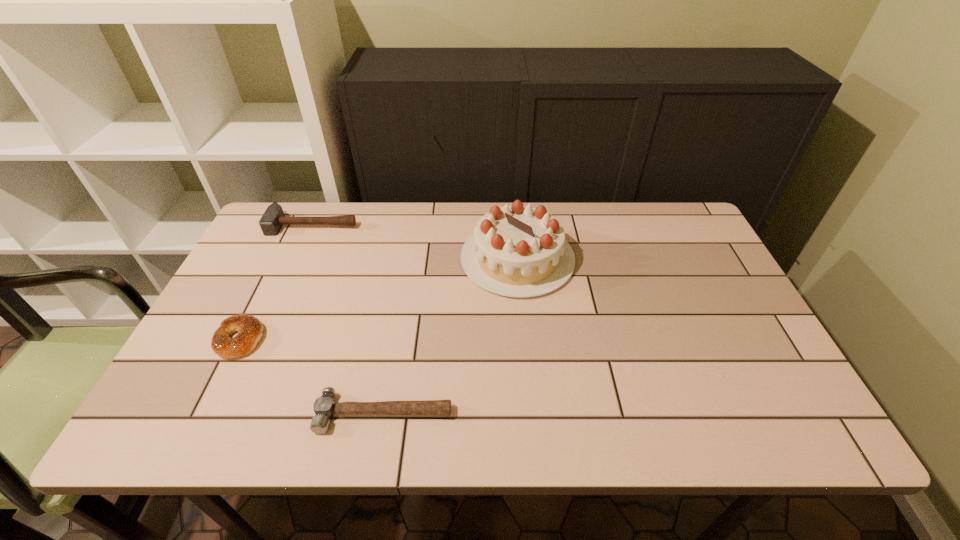
Locate an element on the screen. The width and height of the screenshot is (960, 540). birthday cake is located at coordinates (517, 251).

The image size is (960, 540). I want to click on the rightmost object, so click(517, 251).

This screenshot has height=540, width=960. Find the location of `the taller hammer`. the taller hammer is located at coordinates (273, 219).

Locate an element on the screen. This screenshot has height=540, width=960. the left hammer is located at coordinates (273, 219).

Find the location of a particular element. The height and width of the screenshot is (540, 960). bagel is located at coordinates (249, 328).

At what (x,y) coordinates should I click in order to perform the action: click on the nearest object. Please return your answer as a coordinate pair (x, y). The image size is (960, 540). Looking at the image, I should click on (324, 407).

The image size is (960, 540). I want to click on the shorter hammer, so click(324, 407).

Where is `free space located 0.120m on the left of the birthday cake`? This screenshot has height=540, width=960. free space located 0.120m on the left of the birthday cake is located at coordinates (420, 259).

Locate an element on the screen. vacant space located 0.210m on the striking surface of the taller hammer is located at coordinates (286, 285).

Identify the location of free space located 0.080m on the front of the bagel. This screenshot has height=540, width=960. (214, 392).